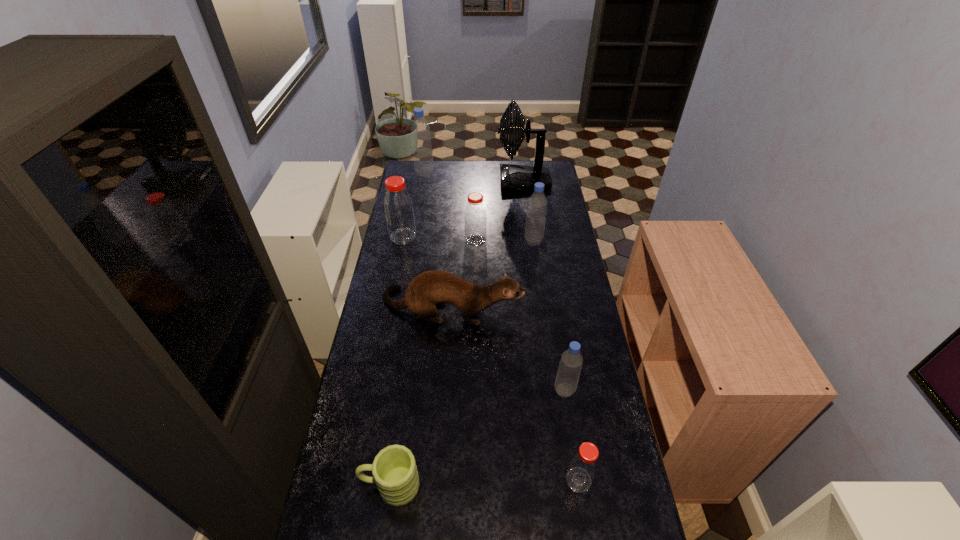
This screenshot has height=540, width=960. Identify the location of free point that satisfies the following two spatial constraints: 1. in front of the fan to blow air; 2. on the left side of the second nearest bottle. (550, 390).